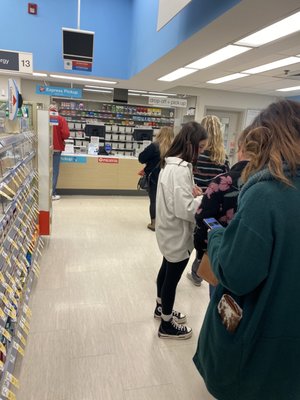
The width and height of the screenshot is (300, 400). I want to click on space between lights, so 242,63.